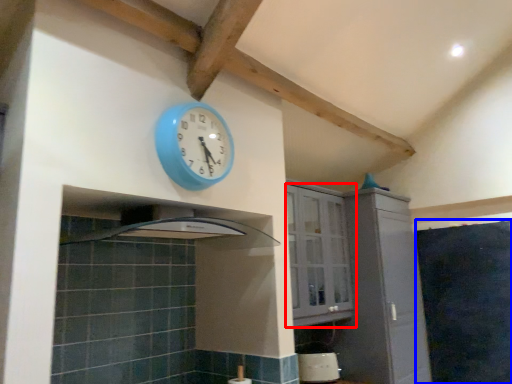
Question: Which of the following is the closest to the observer, cabinetry (highlighted by a red box) or dark (highlighted by a blue box)?

Choices:
 (A) cabinetry
 (B) dark

Answer: (A)